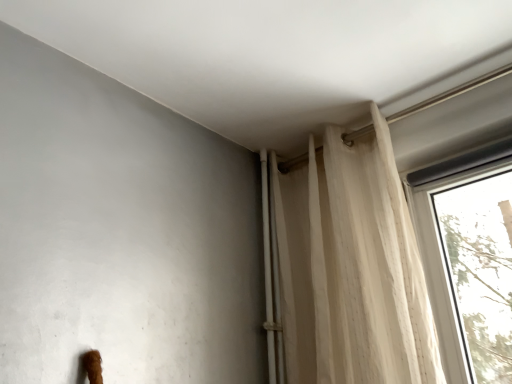
This screenshot has height=384, width=512. Describe the element at coordinates (351, 267) in the screenshot. I see `translucent fabric curtain at upper right` at that location.

Locate an element on the screen. This screenshot has height=384, width=512. translucent fabric curtain at upper right is located at coordinates (351, 267).

Measure the distance between point (291, 289) and camera.

1.52 meters.

What are the coordinates of `translucent fabric curtain at upper right` in the screenshot? It's located at (351, 267).